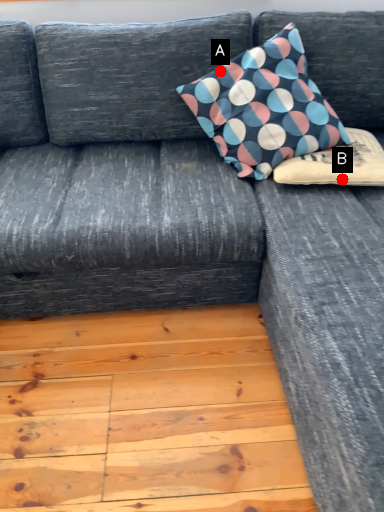
Question: Two points are circled on the image, labeled by A and B beside each circle. Which point is closer to the camera taking this photo?

Choices:
 (A) A is closer
 (B) B is closer

Answer: (B)